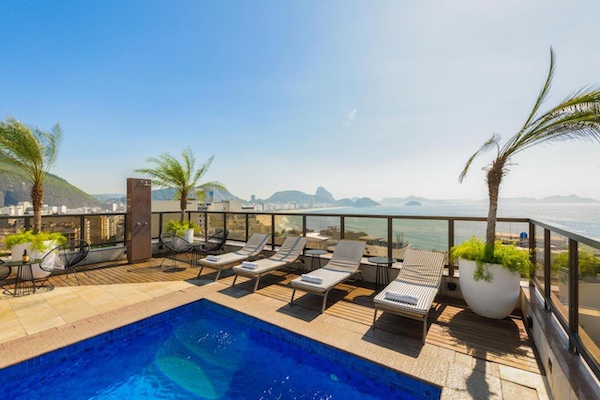
The image size is (600, 400). What are the coordinates of `table` in the screenshot? It's located at (382, 265), (319, 248), (22, 264).